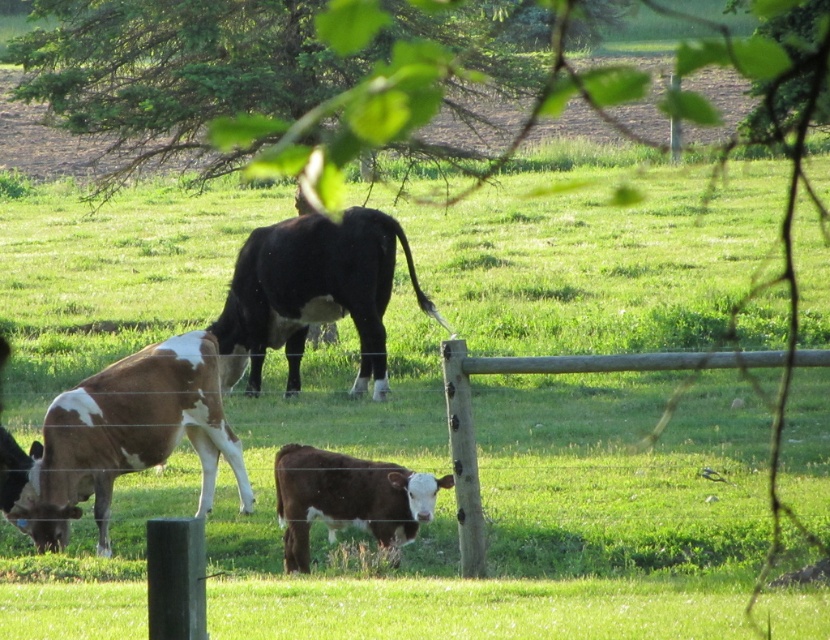
You are a photographer standing behind the wire fence in the foreground. You want to take a photo of the black glossy cow at center without the green leafy tree at upper center blocking it. Is this possible?

The green leafy tree at upper center is further to the viewer than the black glossy cow at center, so the tree is closer to you and would block the cow in the photo.

You are standing in the field and want to approach the brown and white speckled cow at left. Based on its 2D coordinates, which direction should you move from your current position to reach it?

The brown and white speckled cow at left is located at coordinates 0.686 on the x axis and 0.146 on the y axis. Since the x value is greater than 0.5, you should move to the right. The y value is less than 0.5, so you should move downward. Therefore, move diagonally to the right and downward to reach the cow.